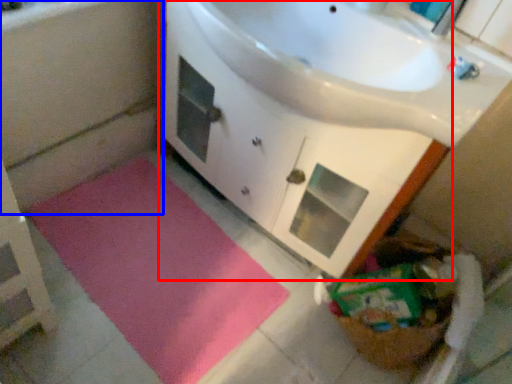
Question: Which object appears farthest to the camera in this image, bathroom cabinet (highlighted by a red box) or bath (highlighted by a blue box)?

Choices:
 (A) bathroom cabinet
 (B) bath

Answer: (B)